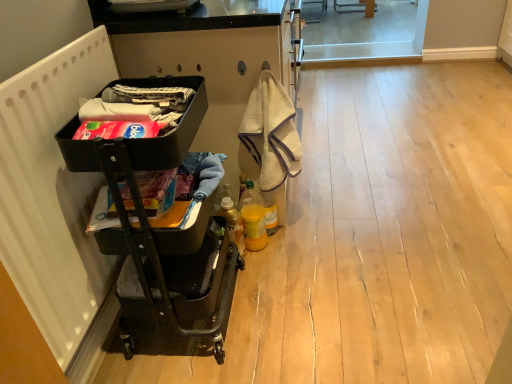
Question: In which direction should I rotate to look at translucent plastic bottle at center, the 1th bottle from the right?

Choices:
 (A) left
 (B) right

Answer: (B)

Question: From the image's perspective, is white matte radiator at left located above beige towel at center?

Choices:
 (A) no
 (B) yes

Answer: (A)

Question: Considering the relative positions of white matte radiator at left and beige towel at center in the image provided, is white matte radiator at left behind beige towel at center?

Choices:
 (A) yes
 (B) no

Answer: (B)

Question: Is white matte radiator at left not near beige towel at center?

Choices:
 (A) yes
 (B) no

Answer: (B)

Question: Does white matte radiator at left have a greater height compared to beige towel at center?

Choices:
 (A) no
 (B) yes

Answer: (B)

Question: Can you confirm if white matte radiator at left is wider than beige towel at center?

Choices:
 (A) yes
 (B) no

Answer: (B)

Question: Is white matte radiator at left smaller than beige towel at center?

Choices:
 (A) no
 (B) yes

Answer: (A)

Question: Is the depth of black metal cart at left greater than that of white matte radiator at left?

Choices:
 (A) no
 (B) yes

Answer: (B)

Question: Can you confirm if black metal cart at left is shorter than white matte radiator at left?

Choices:
 (A) no
 (B) yes

Answer: (A)

Question: Is black metal cart at left taller than white matte radiator at left?

Choices:
 (A) yes
 (B) no

Answer: (A)

Question: From the image's perspective, is black metal cart at left over white matte radiator at left?

Choices:
 (A) yes
 (B) no

Answer: (B)

Question: Is black metal cart at left smaller than white matte radiator at left?

Choices:
 (A) yes
 (B) no

Answer: (B)

Question: Is black metal cart at left closer to the viewer compared to white matte radiator at left?

Choices:
 (A) no
 (B) yes

Answer: (A)

Question: From a real-world perspective, is beige towel at center located higher than translucent plastic bottle at lower center, placed as the second bottle when sorted from right to left?

Choices:
 (A) no
 (B) yes

Answer: (B)